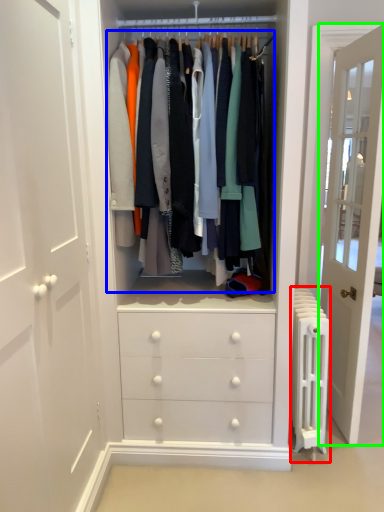
Question: Which is nearer to the radiator (highlighted by a red box)? closet (highlighted by a blue box) or door (highlighted by a green box).

Choices:
 (A) closet
 (B) door

Answer: (B)